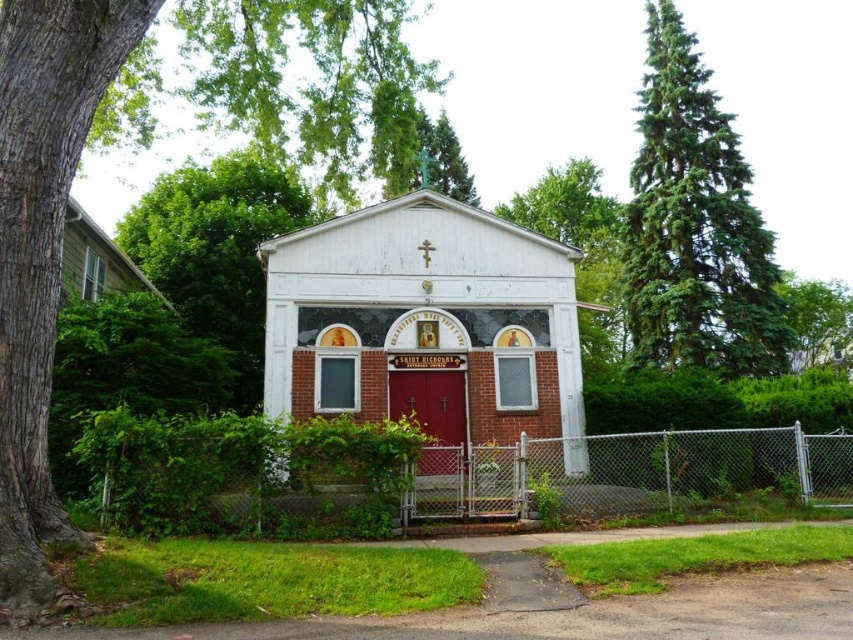
Question: Estimate the real-world distances between objects in this image. Which object is closer to the white painted wood chapel at center?

Choices:
 (A) smooth bark tree at left
 (B) green leafy tree at upper left

Answer: (A)

Question: Does metallic chain-link fence at center have a greater width compared to green coniferous tree at right?

Choices:
 (A) no
 (B) yes

Answer: (B)

Question: Can you confirm if white painted wood chapel at center is smaller than green leafy tree at upper left?

Choices:
 (A) no
 (B) yes

Answer: (B)

Question: Observing the image, what is the correct spatial positioning of smooth bark tree at left in reference to green coniferous tree at right?

Choices:
 (A) below
 (B) above

Answer: (A)

Question: Which of these objects is positioned closest to the smooth bark tree at left?

Choices:
 (A) green leafy tree at upper right
 (B) green leafy tree at upper center
 (C) green coniferous tree at right

Answer: (C)

Question: Which object is the closest to the green coniferous tree at right?

Choices:
 (A) metallic chain-link fence at center
 (B) green leafy tree at upper left

Answer: (A)